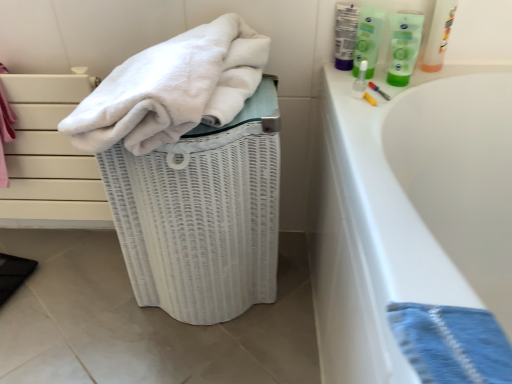
Question: Is blue woven towel at lower right in front of white soft towel at upper left?

Choices:
 (A) yes
 (B) no

Answer: (A)

Question: From the image's perspective, is blue woven towel at lower right beneath white soft towel at upper left?

Choices:
 (A) yes
 (B) no

Answer: (A)

Question: From the image's perspective, is blue woven towel at lower right located above white soft towel at upper left?

Choices:
 (A) yes
 (B) no

Answer: (B)

Question: Is blue woven towel at lower right to the left of white soft towel at upper left from the viewer's perspective?

Choices:
 (A) yes
 (B) no

Answer: (B)

Question: Does blue woven towel at lower right have a larger size compared to white soft towel at upper left?

Choices:
 (A) yes
 (B) no

Answer: (B)

Question: Looking at the image, does white wicker laundry basket at left seem bigger or smaller compared to blue woven towel at lower right?

Choices:
 (A) big
 (B) small

Answer: (A)

Question: From the image's perspective, relative to blue woven towel at lower right, is white wicker laundry basket at left above or below?

Choices:
 (A) above
 (B) below

Answer: (A)

Question: Is white wicker laundry basket at left inside the boundaries of blue woven towel at lower right, or outside?

Choices:
 (A) outside
 (B) inside

Answer: (A)

Question: Would you say white wicker laundry basket at left is to the left or to the right of blue woven towel at lower right in the picture?

Choices:
 (A) left
 (B) right

Answer: (A)

Question: Based on their sizes in the image, would you say green plastic tube at upper right is bigger or smaller than white wicker laundry basket at left?

Choices:
 (A) big
 (B) small

Answer: (B)

Question: From a real-world perspective, relative to white wicker laundry basket at left, is green plastic tube at upper right vertically above or below?

Choices:
 (A) above
 (B) below

Answer: (A)

Question: Is green plastic tube at upper right inside the boundaries of white wicker laundry basket at left, or outside?

Choices:
 (A) inside
 (B) outside

Answer: (B)

Question: Considering the positions of point (395, 51) and point (221, 168), is point (395, 51) closer or farther from the camera than point (221, 168)?

Choices:
 (A) closer
 (B) farther

Answer: (B)

Question: From the image's perspective, is green plastic tube at upper right positioned above or below green plastic bottle at upper right?

Choices:
 (A) above
 (B) below

Answer: (B)

Question: Do you think green plastic tube at upper right is within green plastic bottle at upper right, or outside of it?

Choices:
 (A) inside
 (B) outside

Answer: (B)